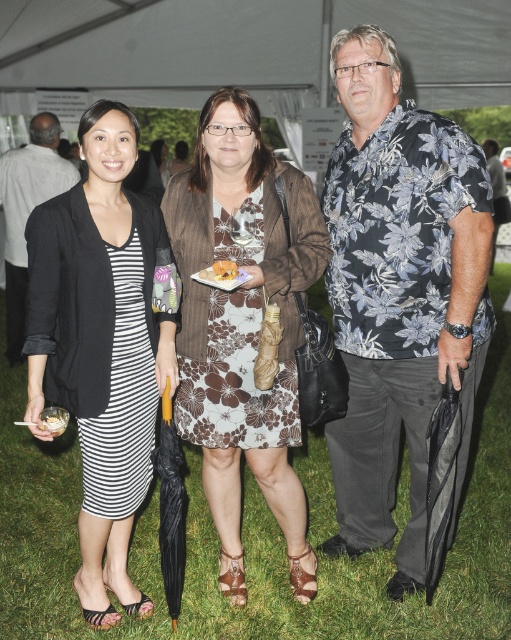
Looking at the image, which object is bigger between the striped fabric dress at center and the white creamy dessert at center?

The striped fabric dress at center is larger in size compared to the white creamy dessert at center.

You are a photographer at the event and want to capture a clear photo of both the striped fabric dress at center and the white creamy dessert at center. Which one should you focus on first to ensure both are in focus?

You should focus on the striped fabric dress at center first since it is closer to the viewer than the white creamy dessert at center, allowing the dessert to fall within the depth of field when focused on the closer object.